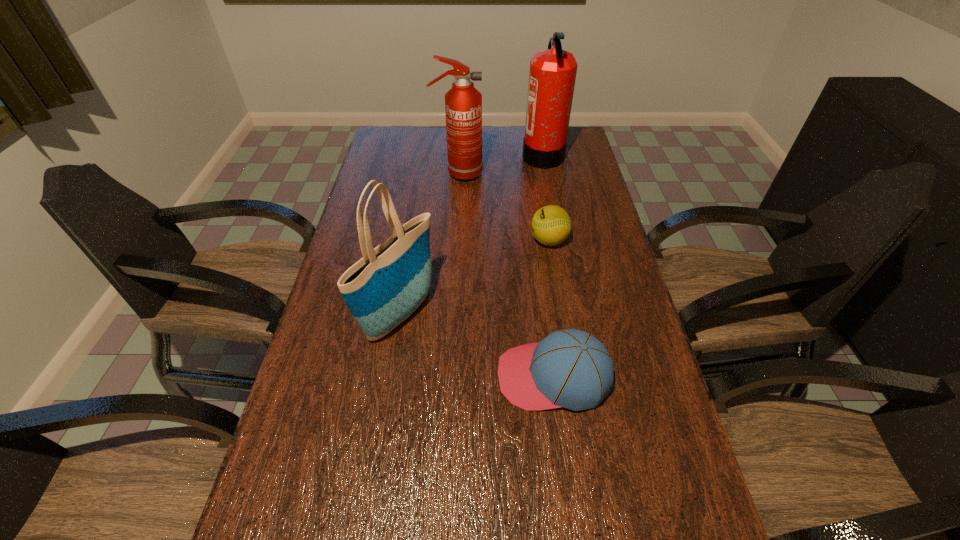
What are the coordinates of `free space between the right fire extinguisher and the left fire extinguisher` in the screenshot? It's located at (500, 165).

At what (x,y) coordinates should I click in order to perform the action: click on free space that is in between the tote bag and the baseball cap. Please return your answer as a coordinate pair (x, y). Image resolution: width=960 pixels, height=540 pixels. Looking at the image, I should click on (477, 345).

Locate which object is the second closest to the baseball cap. Please provide its 2D coordinates. Your answer should be formatted as a tuple, i.e. [(x, y)], where the tuple contains the x and y coordinates of a point satisfying the conditions above.

[(551, 225)]

This screenshot has width=960, height=540. I want to click on the fourth closest object to the right fire extinguisher, so click(569, 368).